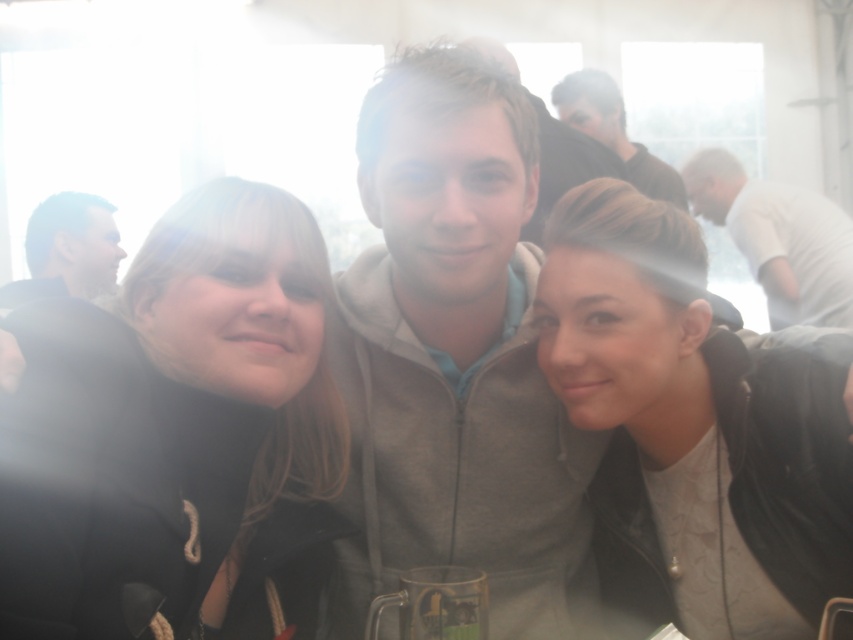
Which of these two, matte black jacket at lower right or matte black hoodie at upper center, stands taller?

matte black hoodie at upper center

Does matte black jacket at lower right appear on the right side of matte black hoodie at upper center?

No, matte black jacket at lower right is not to the right of matte black hoodie at upper center.

The height and width of the screenshot is (640, 853). What are the coordinates of `matte black jacket at lower right` in the screenshot? It's located at (689, 401).

Is gray fleece jacket at center above matte black hoodie at upper center?

Actually, gray fleece jacket at center is below matte black hoodie at upper center.

Can you confirm if gray fleece jacket at center is smaller than matte black hoodie at upper center?

Correct, gray fleece jacket at center occupies less space than matte black hoodie at upper center.

Locate an element on the screen. This screenshot has height=640, width=853. gray fleece jacket at center is located at coordinates (456, 358).

Locate an element on the screen. This screenshot has width=853, height=640. gray fleece jacket at center is located at coordinates (456, 358).

Is matte black jacket at lower right smaller than matte black jacket at left?

Yes.

Which is below, matte black jacket at lower right or matte black jacket at left?

matte black jacket at lower right is below.

Is point (654, 545) positioned behind point (73, 221)?

No, it is in front of (73, 221).

Locate an element on the screen. The height and width of the screenshot is (640, 853). matte black jacket at lower right is located at coordinates (689, 401).